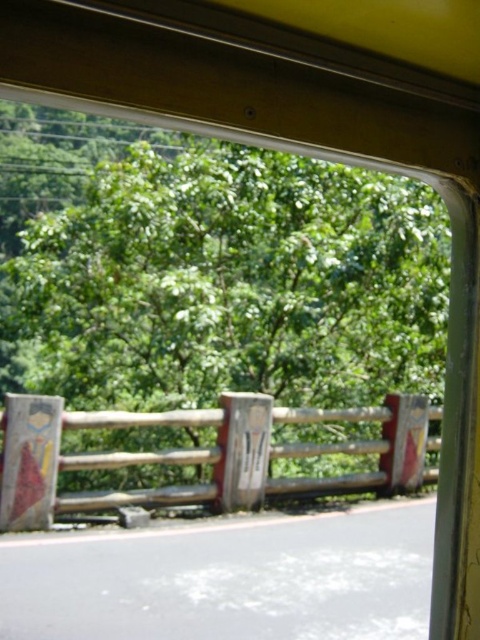
You are sitting inside the vehicle and looking out through the window. You notice two points marked on the window at coordinates point (131, 189) and point (430, 417). Which of these two points is nearer to your eyes?

Point (131, 189) is closer to the camera than point (430, 417), so the point at (131, 189) is nearer to your eyes.

You are a passenger in the vehicle and notice the green leafy tree at center and the wooden fence at lower center through the window. Which object appears bigger in the scene?

The green leafy tree at center appears bigger than the wooden fence at lower center because it has a larger size compared to it.

You are a passenger in the vehicle and looking out the window. You see the green leafy tree at center and the wooden fence at lower center. Which object appears taller from your viewpoint?

The green leafy tree at center appears taller than the wooden fence at lower center because it has a greater height compared to the wooden fence at lower center.